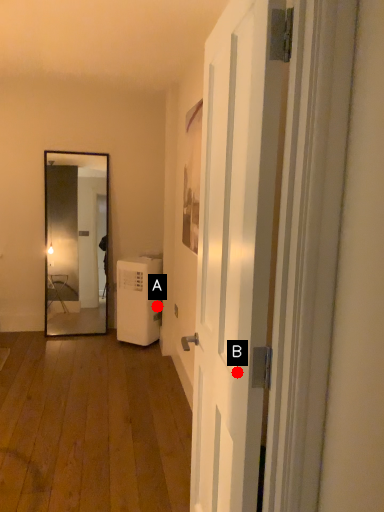
Question: Two points are circled on the image, labeled by A and B beside each circle. Which point is closer to the camera?

Choices:
 (A) A is closer
 (B) B is closer

Answer: (B)